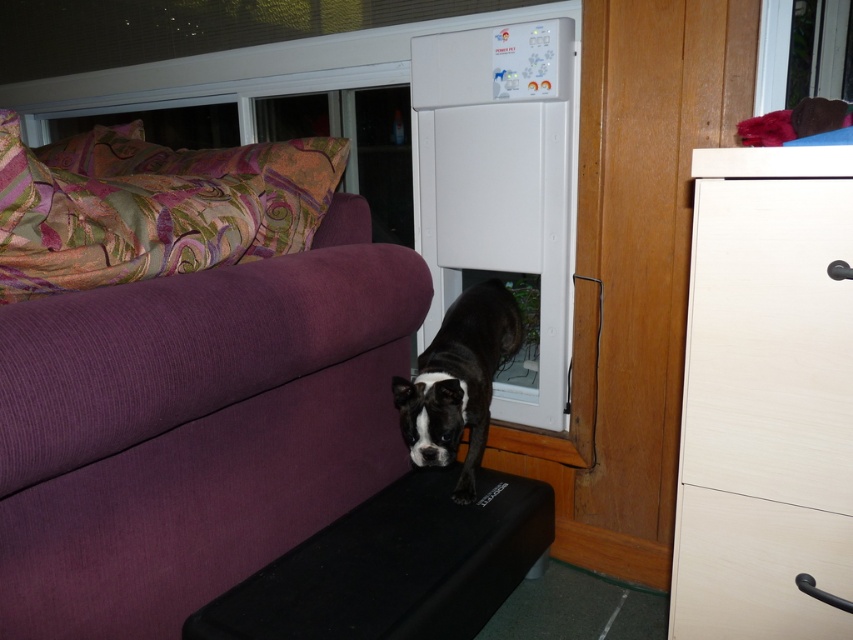
Which is above, black rubber footrest at lower center or white wood drawer at lower right?

white wood drawer at lower right is above.

Is black rubber footrest at lower center below white wood drawer at lower right?

Yes.

This screenshot has width=853, height=640. What do you see at coordinates (393, 564) in the screenshot?
I see `black rubber footrest at lower center` at bounding box center [393, 564].

At what (x,y) coordinates should I click in order to perform the action: click on black rubber footrest at lower center. Please return your answer as a coordinate pair (x, y). The height and width of the screenshot is (640, 853). Looking at the image, I should click on (393, 564).

Looking at this image, does purple corduroy couch at lower left have a greater width compared to black matte dog at center?

Yes, purple corduroy couch at lower left is wider than black matte dog at center.

Between point (299, 387) and point (444, 390), which one is positioned behind?

The point (444, 390) is more distant.

Does point (149, 429) come closer to viewer compared to point (415, 467)?

That is True.

The height and width of the screenshot is (640, 853). What are the coordinates of `purple corduroy couch at lower left` in the screenshot? It's located at (194, 426).

Is white plastic screen door at center in front of black matte dog at center?

No, it is behind black matte dog at center.

Looking at this image, which of these two, white plastic screen door at center or black matte dog at center, stands taller?

white plastic screen door at center is taller.

Who is more forward, (494, 204) or (468, 388)?

Point (468, 388) is in front.

The height and width of the screenshot is (640, 853). Identify the location of white plastic screen door at center. (500, 182).